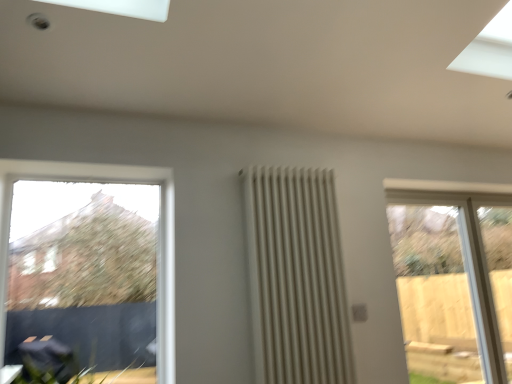
Question: Considering the positions of clear glass window at left, the 2th window when ordered from right to left, and white matte radiator at center in the image, is clear glass window at left, the 2th window when ordered from right to left, taller or shorter than white matte radiator at center?

Choices:
 (A) tall
 (B) short

Answer: (B)

Question: In terms of width, does clear glass window at left, positioned as the 2th window in back-to-front order, look wider or thinner when compared to white matte radiator at center?

Choices:
 (A) thin
 (B) wide

Answer: (A)

Question: Estimate the real-world distances between objects in this image. Which object is farther from the clear glass door at right, the first window positioned from the back?

Choices:
 (A) white matte radiator at center
 (B) clear glass window at left, positioned as the 2th window in back-to-front order

Answer: (B)

Question: Based on their relative distances, which object is nearer to the clear glass door at right, marked as the first window in a right-to-left arrangement?

Choices:
 (A) white matte radiator at center
 (B) clear glass window at left, positioned as the 2th window in back-to-front order

Answer: (A)